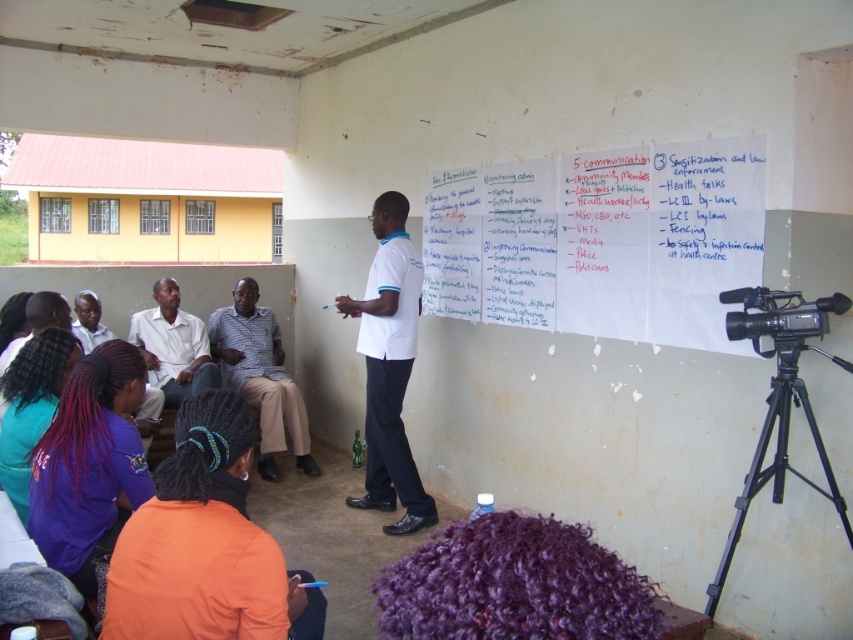
How distant is purple fabric hair at lower left from black plastic video camera at lower right?

A distance of 7.89 feet exists between purple fabric hair at lower left and black plastic video camera at lower right.

Can you confirm if purple fabric hair at lower left is taller than black plastic video camera at lower right?

Yes, purple fabric hair at lower left is taller than black plastic video camera at lower right.

This screenshot has width=853, height=640. What do you see at coordinates (90, 464) in the screenshot?
I see `purple fabric hair at lower left` at bounding box center [90, 464].

At what (x,y) coordinates should I click in order to perform the action: click on purple fabric hair at lower left. Please return your answer as a coordinate pair (x, y). Looking at the image, I should click on (90, 464).

Is black plastic video camera at lower right to the right of matte white shirt at upper left from the viewer's perspective?

Yes, black plastic video camera at lower right is to the right of matte white shirt at upper left.

Is black plastic video camera at lower right further to the viewer compared to matte white shirt at upper left?

No.

Which is behind, point (730, 317) or point (83, 330)?

The point (83, 330) is more distant.

This screenshot has width=853, height=640. What are the coordinates of `black plastic video camera at lower right` in the screenshot? It's located at [x=778, y=316].

Which of these two, white paper at upper right or black metal tripod at lower right, stands taller?

Standing taller between the two is white paper at upper right.

You are a GUI agent. You are given a task and a screenshot of the screen. Output one action in this format:
    pyautogui.click(x=<x>, y=<y>)
    Task: Click on the white paper at upper right
    The height and width of the screenshot is (640, 853).
    Given the screenshot: What is the action you would take?
    pyautogui.click(x=601, y=241)